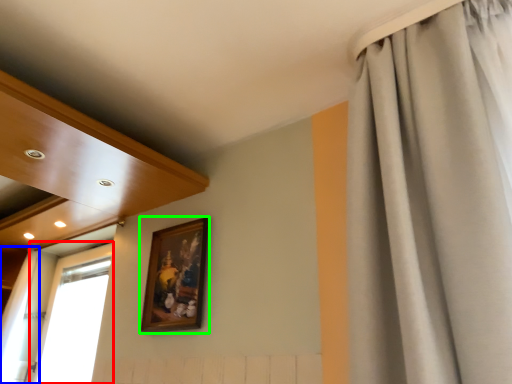
Question: Which is nearer to the window (highlighted by a red box)? curtain (highlighted by a blue box) or picture frame (highlighted by a green box).

Choices:
 (A) curtain
 (B) picture frame

Answer: (A)